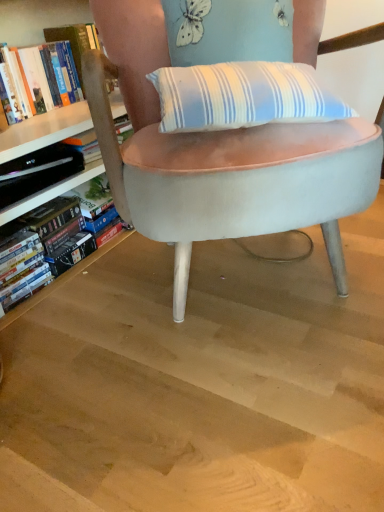
At what (x,y) coordinates should I click in order to perform the action: click on vacant space underneath velvet light blue chair at center (from a real-world perspective). Please return your answer as a coordinate pair (x, y). The image size is (384, 512). Looking at the image, I should click on (241, 270).